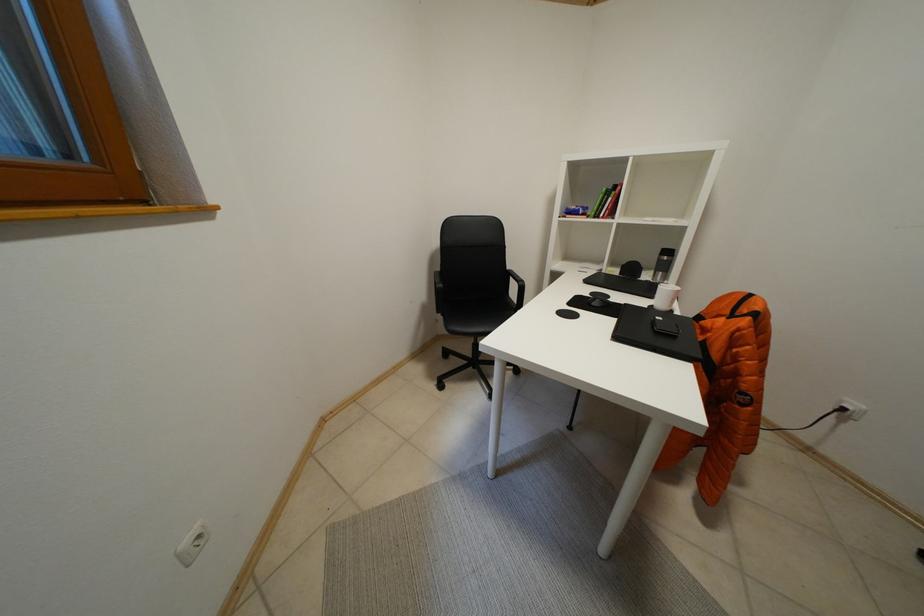
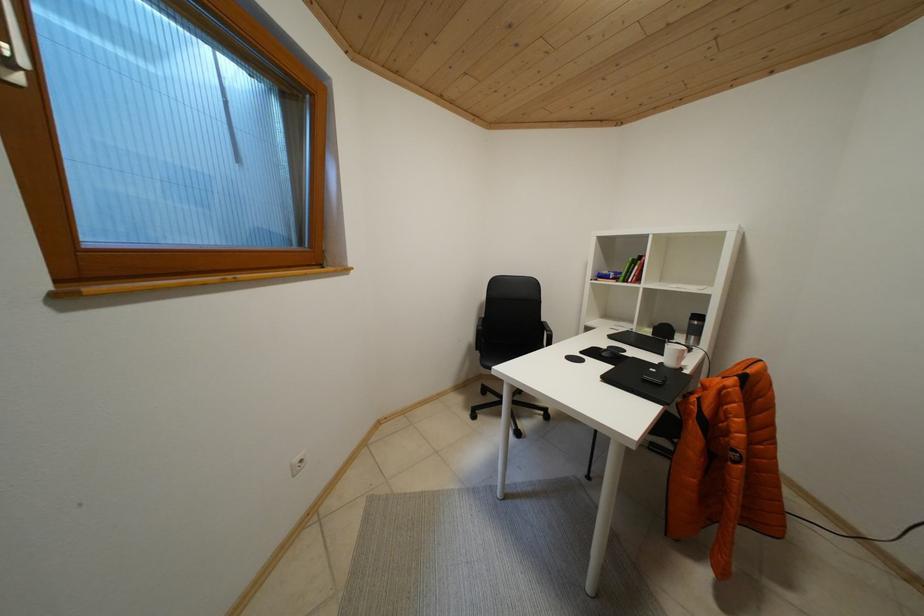
The images are taken continuously from a first-person perspective. In which direction are you moving?

The movement direction of the cameraman is right, backward.